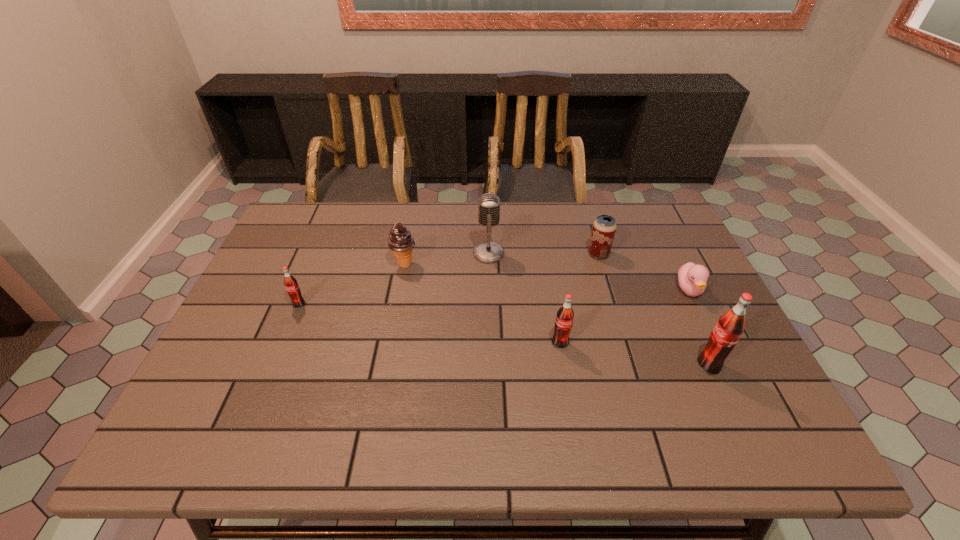
Find the location of a particular element. This screenshot has height=540, width=960. location for an additional pop_(soda) to make spacing equal is located at coordinates (424, 323).